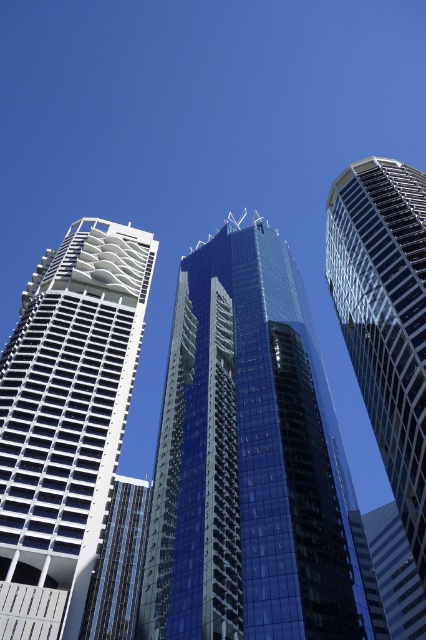
Question: Can you confirm if shiny glass skyscraper at center is smaller than glassy reflective skyscraper at right?

Choices:
 (A) no
 (B) yes

Answer: (A)

Question: From the image, what is the correct spatial relationship of white lattice tower at left in relation to glassy reflective skyscraper at right?

Choices:
 (A) right
 (B) left

Answer: (B)

Question: Which of the following is the closest to the observer?

Choices:
 (A) white lattice tower at left
 (B) shiny glass skyscraper at center
 (C) glassy reflective skyscraper at right

Answer: (A)

Question: Which point appears closest to the camera in this image?

Choices:
 (A) (51, 545)
 (B) (363, 378)
 (C) (298, 376)

Answer: (A)

Question: Which object is closer to the camera taking this photo?

Choices:
 (A) shiny glass skyscraper at center
 (B) white lattice tower at left

Answer: (B)

Question: Is white lattice tower at left wider than glassy reflective skyscraper at right?

Choices:
 (A) yes
 (B) no

Answer: (A)